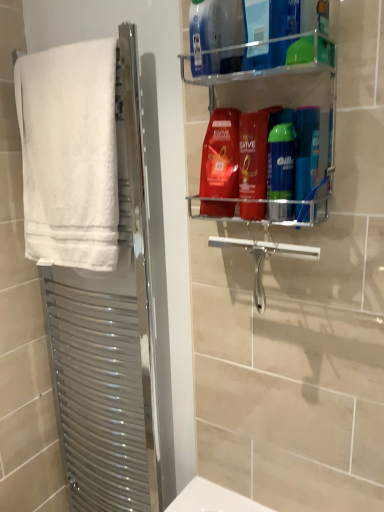
Question: From the image's perspective, is white fluffy towel at left above or below silver metallic towel rack at left?

Choices:
 (A) above
 (B) below

Answer: (A)

Question: Is point (112, 53) positioned closer to the camera than point (135, 413)?

Choices:
 (A) farther
 (B) closer

Answer: (B)

Question: Which object is positioned farthest from the blue plastic bottle at upper center, which ranks as the first cleaning product in top-to-bottom order?

Choices:
 (A) blue glossy shampoo at upper right, which is counted as the 1th toiletry, starting from the right
 (B) shiny red shampoo at upper center, which ranks as the third cleaning product in top-to-bottom order
 (C) clear plastic shelf at upper right
 (D) silver metallic towel rack at left
 (E) white fluffy towel at left

Answer: (D)

Question: Which object is positioned closest to the silver metallic towel rack at left?

Choices:
 (A) shiny red shampoo at center, the second cleaning product when ordered from top to bottom
 (B) green glossy shaving cream can at center right, the second toiletry positioned from the right
 (C) blue plastic bottle at upper center, which ranks as the first cleaning product in top-to-bottom order
 (D) white fluffy towel at left
 (E) clear plastic shelf at upper right

Answer: (D)